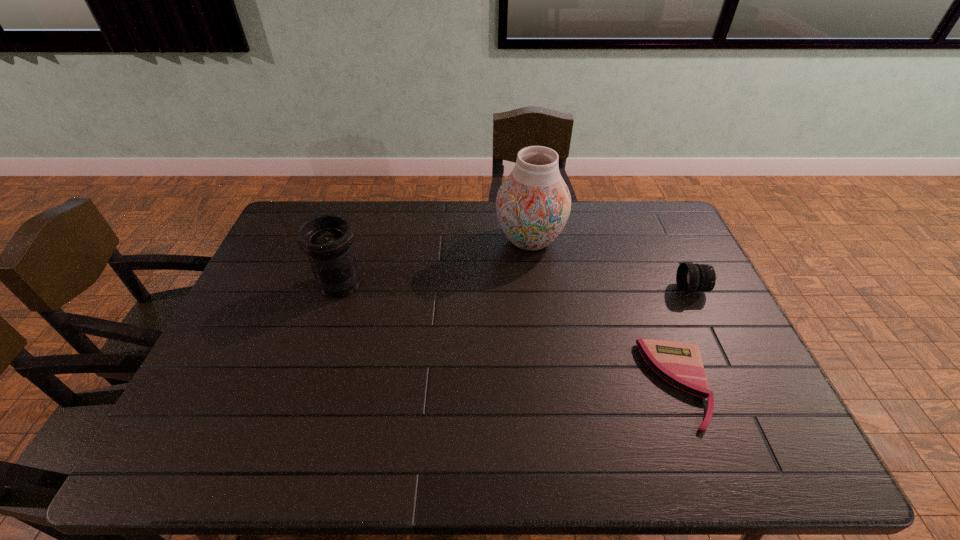
Locate an element on the screen. vacant position located 0.390m at the front element of the rightmost object is located at coordinates (551, 289).

I want to click on free space located at the front element of the rightmost object, so click(564, 289).

This screenshot has width=960, height=540. What are the coordinates of `vacant space situated 0.120m at the front element of the rightmost object` in the screenshot? It's located at (639, 289).

This screenshot has height=540, width=960. Find the location of `free region located on the left of the third object from left to right`. free region located on the left of the third object from left to right is located at coordinates [541, 384].

The width and height of the screenshot is (960, 540). In order to click on object positioned at the far edge in this screenshot , I will do `click(533, 204)`.

Where is `object at the near edge`? object at the near edge is located at coordinates (680, 364).

This screenshot has width=960, height=540. I want to click on telephoto lens present at the right edge, so click(x=690, y=278).

Locate an element on the screen. The height and width of the screenshot is (540, 960). wristlet that is at the right edge is located at coordinates (680, 364).

Identify the location of object positioned at the near right corner. (680, 364).

Identify the location of vacant position at the far edge of the desktop. This screenshot has height=540, width=960. 572,228.